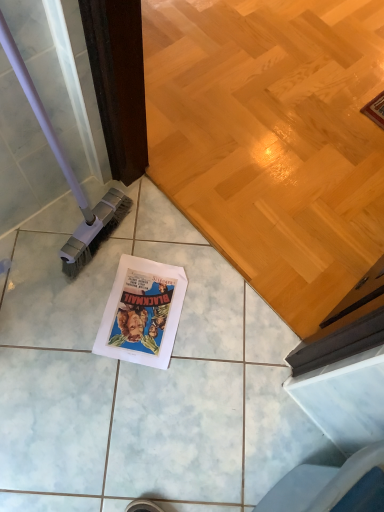
This screenshot has width=384, height=512. I want to click on empty space that is to the right of white paper comic book at center, so click(221, 331).